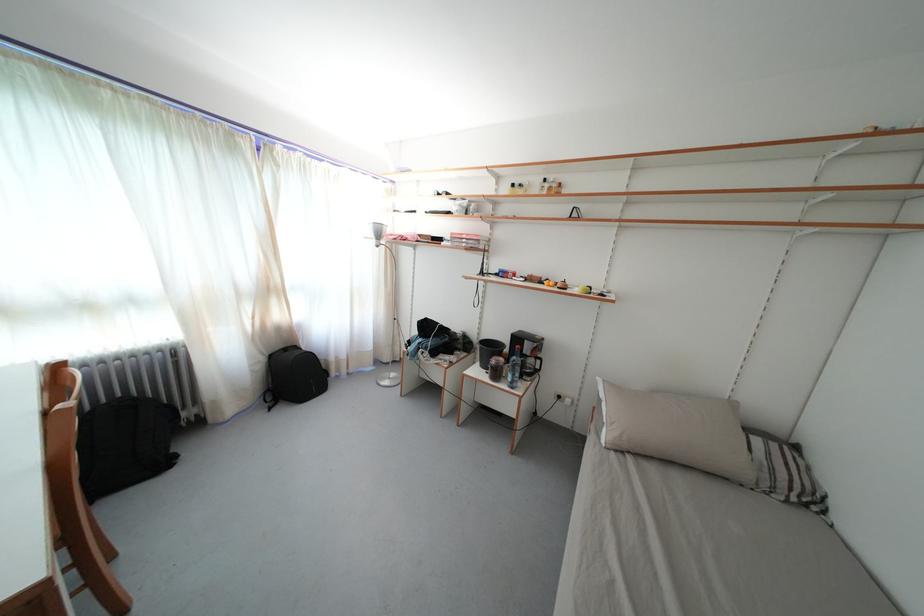
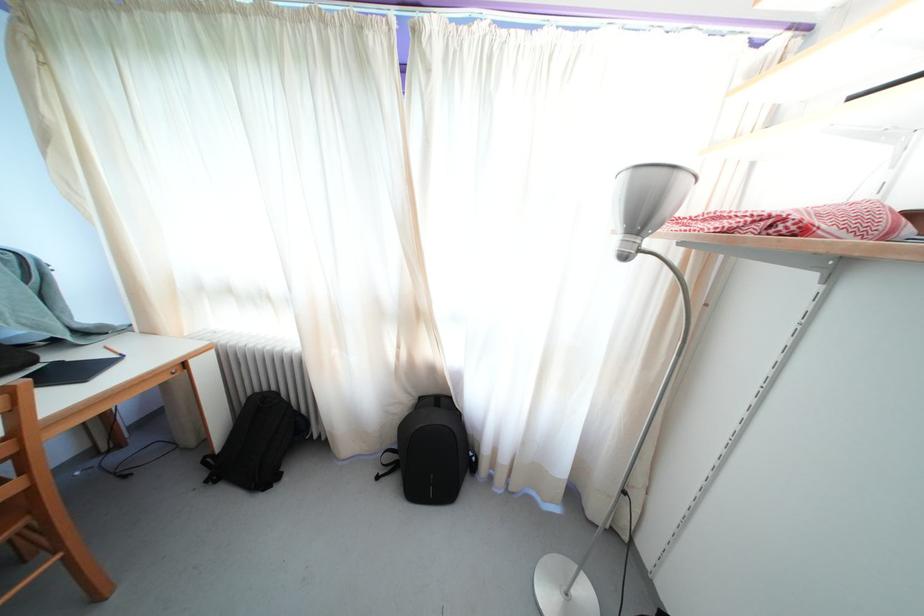
In the second image, find the point that corresponds to (276,362) in the first image.

(427, 405)